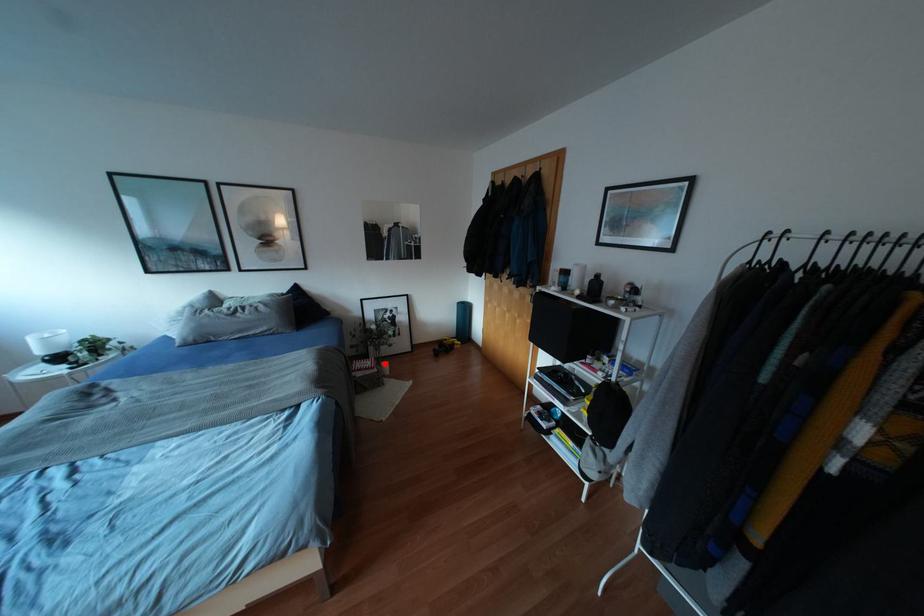
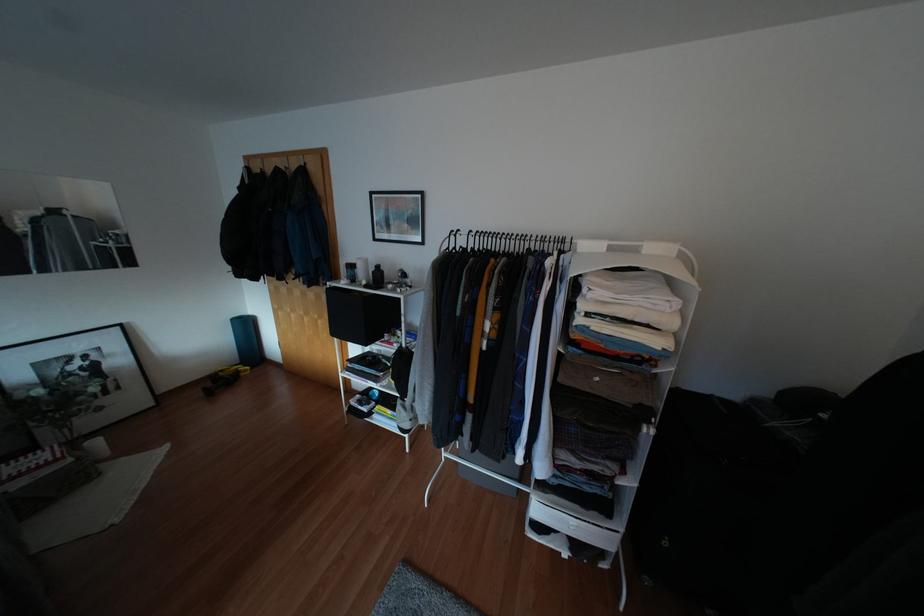
Question: A red point is marked in image1. In image2, is the corresponding 3D point closer to the camera or farther? Reply with the corresponding letter.

Choices:
 (A) The corresponding 3D point is closer.
 (B) The corresponding 3D point is farther.

Answer: (B)